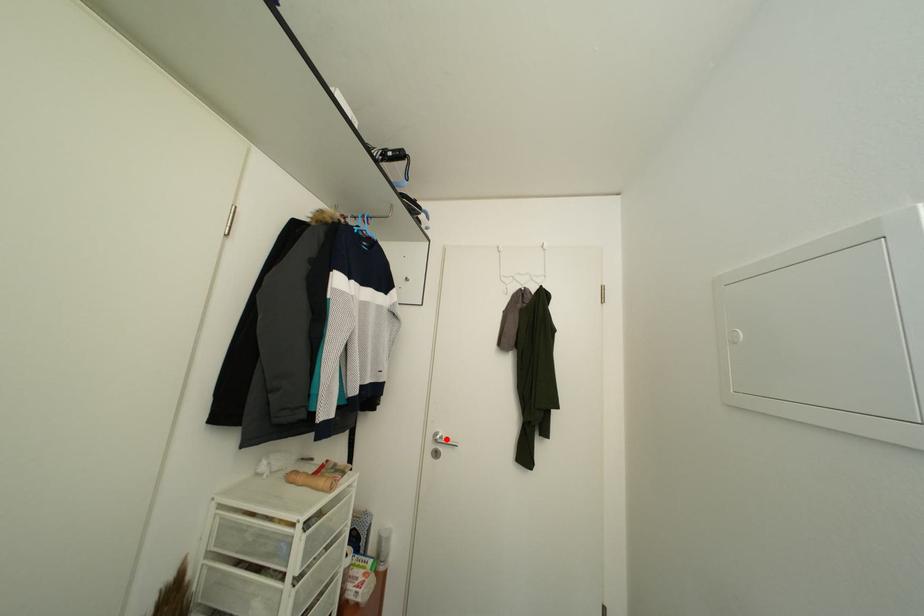
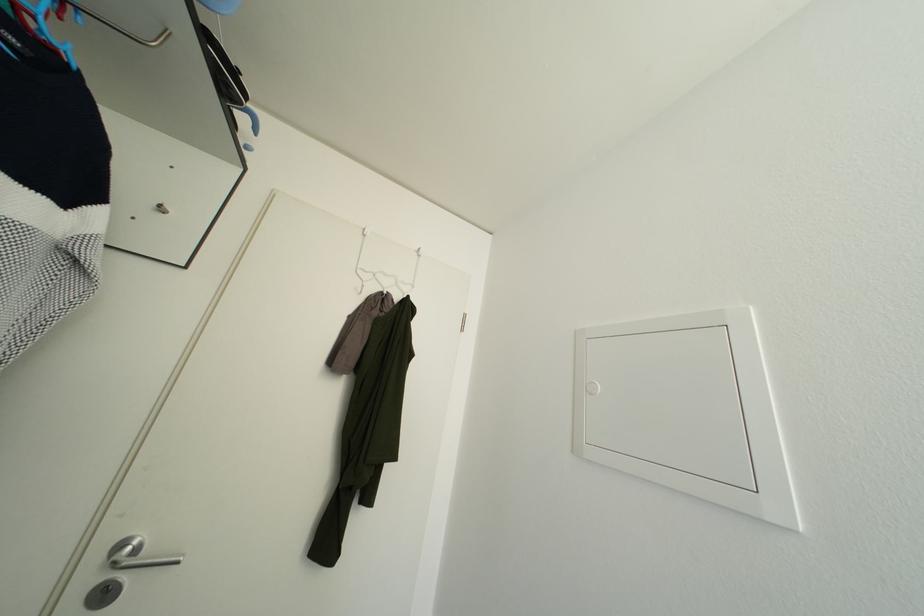
In the second image, find the point that corresponds to the highlighted location in the first image.

(142, 546)